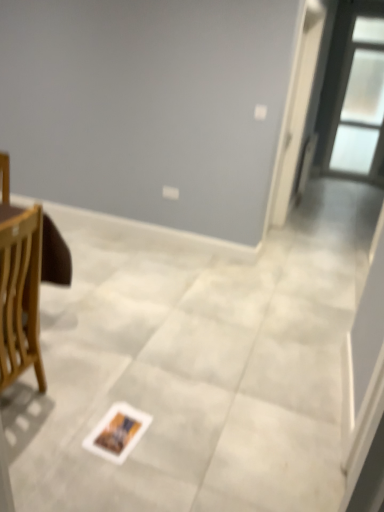
Locate an element on the screen. The width and height of the screenshot is (384, 512). white paper postcard at center is located at coordinates (117, 432).

This screenshot has height=512, width=384. What are the coordinates of `white glossy screen door at upper right` in the screenshot? It's located at (298, 110).

From the image's perspective, which one is positioned higher, white glossy screen door at upper right or transparent glass window at upper right?

transparent glass window at upper right is shown above in the image.

Is white glossy screen door at upper right to the left or to the right of transparent glass window at upper right in the image?

Clearly, white glossy screen door at upper right is on the left of transparent glass window at upper right in the image.

Could you tell me if white glossy screen door at upper right is turned towards transparent glass window at upper right?

No, white glossy screen door at upper right is not aimed at transparent glass window at upper right.

Is white glossy screen door at upper right smaller than transparent glass window at upper right?

No, white glossy screen door at upper right is not smaller than transparent glass window at upper right.

Does white glossy screen door at upper right lie behind white paper postcard at center?

Yes, it is behind white paper postcard at center.

Between white glossy screen door at upper right and white paper postcard at center, which one has more height?

white glossy screen door at upper right.

Would you say white glossy screen door at upper right contains white paper postcard at center?

No, white paper postcard at center is not surrounded by white glossy screen door at upper right.

Can you tell me how much white paper postcard at center and white glossy screen door at upper right differ in facing direction?

87.4 degrees.

In terms of size, does white paper postcard at center appear bigger or smaller than white glossy screen door at upper right?

white paper postcard at center is smaller than white glossy screen door at upper right.

Which object is positioned more to the left, white paper postcard at center or white glossy screen door at upper right?

white paper postcard at center.

Identify the location of screen door above the white paper postcard at center (from a real-world perspective). Image resolution: width=384 pixels, height=512 pixels. (298, 110).

From the picture: Could you tell me if white paper postcard at center is facing transparent glass window at upper right?

No, white paper postcard at center is not turned towards transparent glass window at upper right.

Where is `window behind the white paper postcard at center`? This screenshot has height=512, width=384. window behind the white paper postcard at center is located at coordinates (354, 94).

From a real-world perspective, is white paper postcard at center positioned over transparent glass window at upper right based on gravity?

Actually, white paper postcard at center is physically below transparent glass window at upper right in the real world.

Is the position of white paper postcard at center more distant than that of transparent glass window at upper right?

No, white paper postcard at center is in front of transparent glass window at upper right.

From the image's perspective, is transparent glass window at upper right under white paper postcard at center?

No.

From a real-world perspective, is transparent glass window at upper right on top of white paper postcard at center?

Correct, in the physical world, transparent glass window at upper right is higher than white paper postcard at center.

In the scene shown: Is transparent glass window at upper right taller than white paper postcard at center?

Yes.

At what (x,y) coordinates should I click in order to perform the action: click on postcard directly beneath the transparent glass window at upper right (from a real-world perspective). Please return your answer as a coordinate pair (x, y). This screenshot has width=384, height=512. Looking at the image, I should click on (117, 432).

Does transparent glass window at upper right have a larger size compared to white glossy screen door at upper right?

No.

Is transparent glass window at upper right far away from white glossy screen door at upper right?

That's right, there is a large distance between transparent glass window at upper right and white glossy screen door at upper right.

From a real-world perspective, is transparent glass window at upper right physically above white glossy screen door at upper right?

Incorrect, from a real-world perspective, transparent glass window at upper right is lower than white glossy screen door at upper right.

Relative to white glossy screen door at upper right, is transparent glass window at upper right in front or behind?

transparent glass window at upper right is behind white glossy screen door at upper right.

In order to click on window above the white glossy screen door at upper right (from the image's perspective) in this screenshot , I will do `click(354, 94)`.

Image resolution: width=384 pixels, height=512 pixels. I want to click on screen door behind the white paper postcard at center, so click(298, 110).

Which object lies nearer to the anchor point transparent glass window at upper right, white paper postcard at center or white glossy screen door at upper right?

The object closer to transparent glass window at upper right is white glossy screen door at upper right.

Looking at the image, which one is located closer to white paper postcard at center, white glossy screen door at upper right or transparent glass window at upper right?

white glossy screen door at upper right is closer to white paper postcard at center.

Which object lies further to the anchor point white glossy screen door at upper right, transparent glass window at upper right or white paper postcard at center?

white paper postcard at center is further to white glossy screen door at upper right.

Which object lies nearer to the anchor point white paper postcard at center, transparent glass window at upper right or white glossy screen door at upper right?

white glossy screen door at upper right lies closer to white paper postcard at center than the other object.

From the image, which object appears to be farther from transparent glass window at upper right, white glossy screen door at upper right or white paper postcard at center?

Based on the image, white paper postcard at center appears to be further to transparent glass window at upper right.

Considering their positions, is white paper postcard at center positioned further to white glossy screen door at upper right than transparent glass window at upper right?

Among the two, white paper postcard at center is located further to white glossy screen door at upper right.

You are a GUI agent. You are given a task and a screenshot of the screen. Output one action in this format:
    pyautogui.click(x=<x>, y=<y>)
    Task: Click on the screen door between white paper postcard at center and transparent glass window at upper right in the front-back direction
    
    Given the screenshot: What is the action you would take?
    pyautogui.click(x=298, y=110)